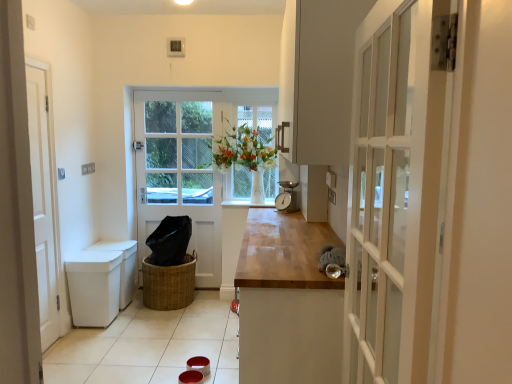
I want to click on free spot above white wooden door at center, marked as the first door in a right-to-left arrangement (from a real-world perspective), so click(x=186, y=94).